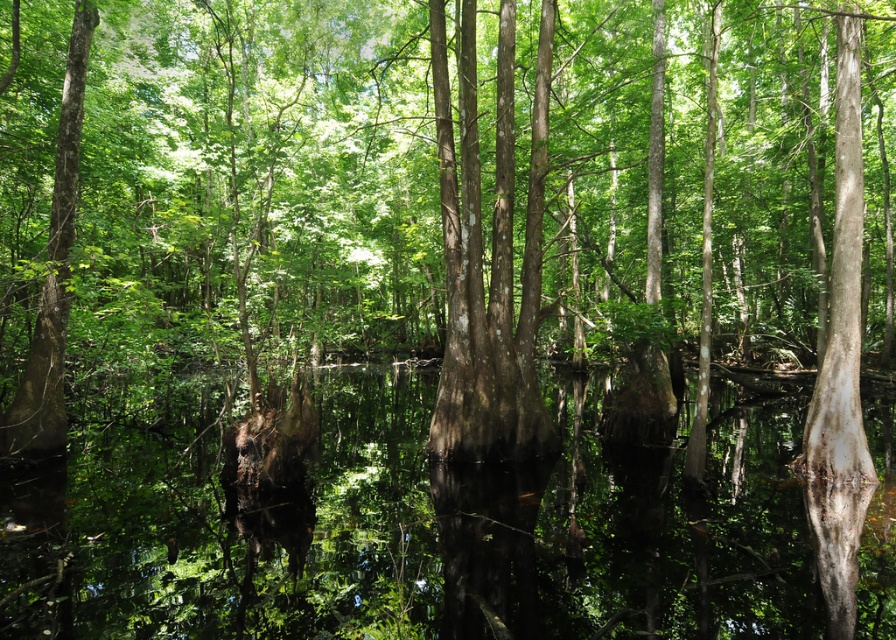
Describe the element at coordinates (429, 182) in the screenshot. This screenshot has width=896, height=640. I see `smooth bark tree at center` at that location.

Which is more to the left, smooth bark tree at center or transparent water at center?

smooth bark tree at center

Who is more distant from viewer, (691, 42) or (751, 572)?

Positioned behind is point (691, 42).

What are the coordinates of `smooth bark tree at center` in the screenshot? It's located at (429, 182).